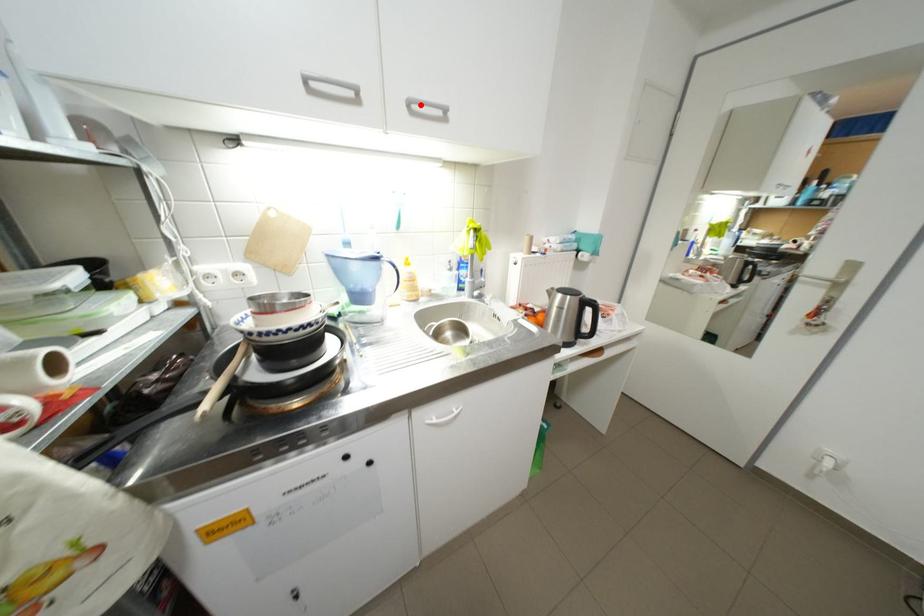
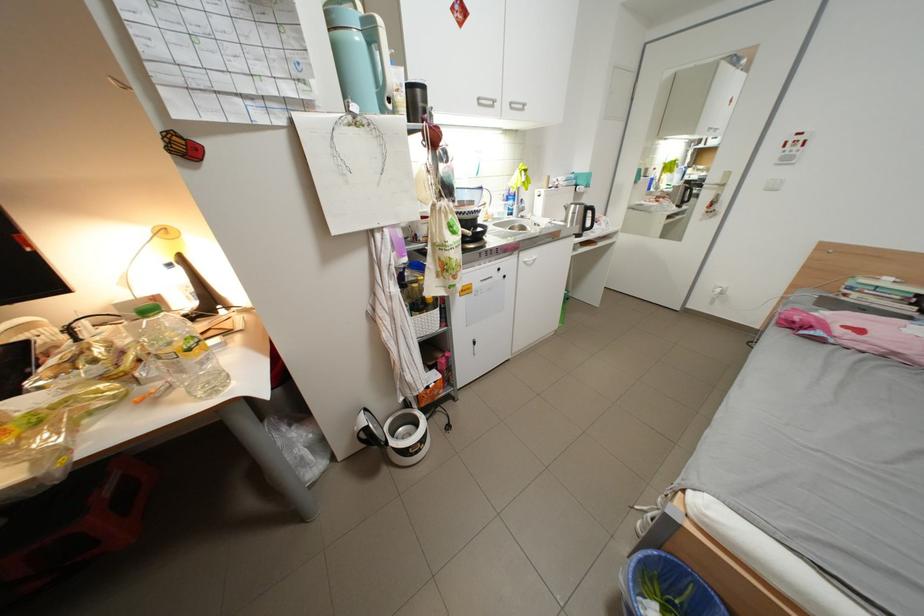
Locate, in the second image, the point that corresponds to the highlighted location in the first image.

(523, 105)